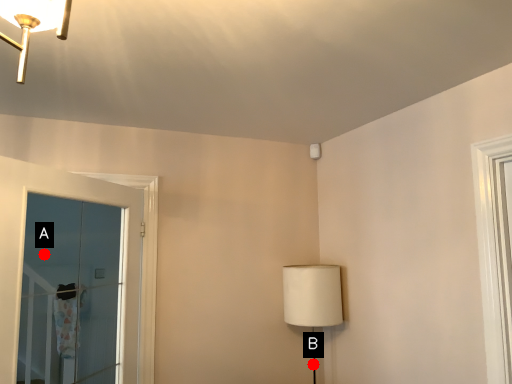
Question: Two points are circled on the image, labeled by A and B beside each circle. Which of the following is the farthest from the observer?

Choices:
 (A) A is further
 (B) B is further

Answer: (A)